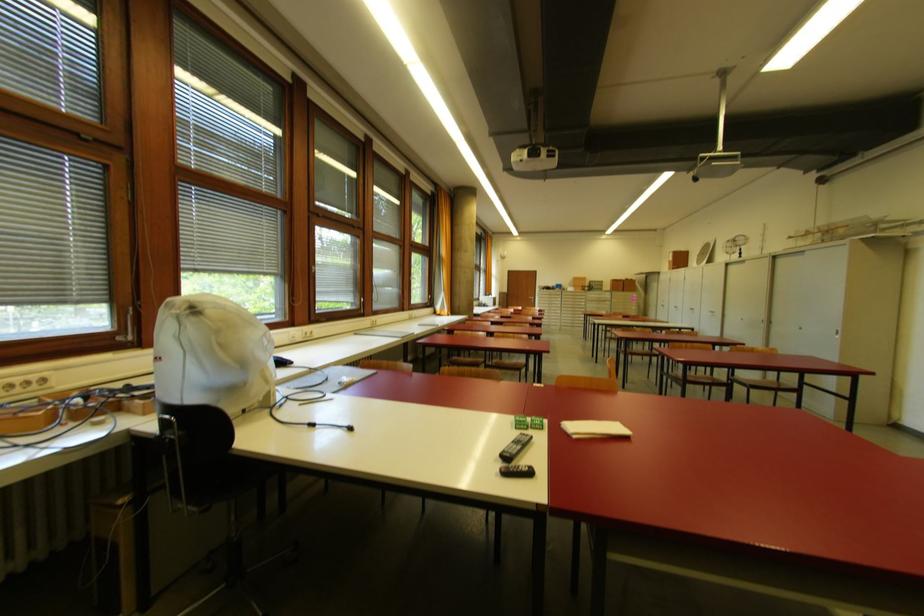
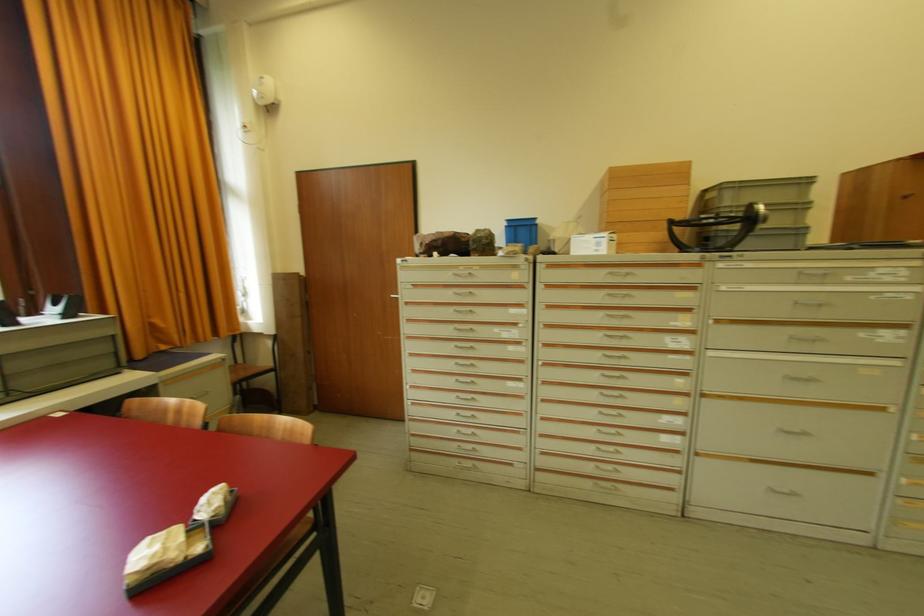
Where in the second image is the point corresponding to pixel 569 292 from the first image?

(570, 254)